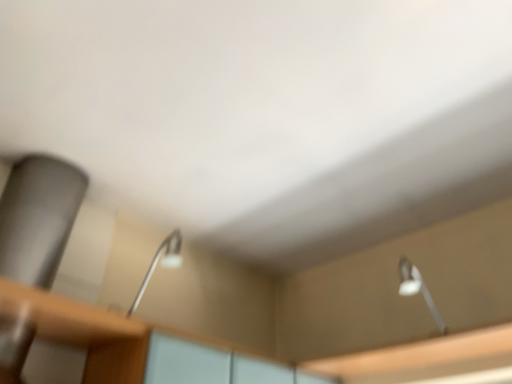
Question: Should I look upward or downward to see metallic silver lamp at center, which is counted as the 1th lamp, starting from the left?

Choices:
 (A) up
 (B) down

Answer: (B)

Question: Is metallic silver lamp at center, positioned as the 2th lamp in right-to-left order, inside white glossy lamp at upper right, arranged as the first lamp when viewed from the right?

Choices:
 (A) yes
 (B) no

Answer: (B)

Question: Is white glossy lamp at upper right, positioned as the second lamp in left-to-right order, to the left of metallic silver lamp at center, which is counted as the 1th lamp, starting from the left, from the viewer's perspective?

Choices:
 (A) yes
 (B) no

Answer: (B)

Question: From the image's perspective, is white glossy lamp at upper right, positioned as the second lamp in left-to-right order, above metallic silver lamp at center, positioned as the 2th lamp in right-to-left order?

Choices:
 (A) no
 (B) yes

Answer: (A)

Question: Is white glossy lamp at upper right, positioned as the second lamp in left-to-right order, at the right side of metallic silver lamp at center, positioned as the 2th lamp in right-to-left order?

Choices:
 (A) yes
 (B) no

Answer: (A)

Question: Is metallic silver lamp at center, which is counted as the 1th lamp, starting from the left, at the back of white glossy lamp at upper right, positioned as the second lamp in left-to-right order?

Choices:
 (A) no
 (B) yes

Answer: (A)

Question: Does white glossy lamp at upper right, arranged as the first lamp when viewed from the right, come in front of metallic silver lamp at center, positioned as the 2th lamp in right-to-left order?

Choices:
 (A) no
 (B) yes

Answer: (A)

Question: Is wooden table at lower left with metallic silver lamp at center, positioned as the 2th lamp in right-to-left order?

Choices:
 (A) no
 (B) yes

Answer: (A)

Question: Can you confirm if wooden table at lower left is smaller than metallic silver lamp at center, positioned as the 2th lamp in right-to-left order?

Choices:
 (A) no
 (B) yes

Answer: (A)

Question: Is wooden table at lower left completely or partially outside of metallic silver lamp at center, positioned as the 2th lamp in right-to-left order?

Choices:
 (A) yes
 (B) no

Answer: (A)

Question: Is wooden table at lower left facing away from metallic silver lamp at center, which is counted as the 1th lamp, starting from the left?

Choices:
 (A) yes
 (B) no

Answer: (B)

Question: Does wooden table at lower left come in front of metallic silver lamp at center, positioned as the 2th lamp in right-to-left order?

Choices:
 (A) no
 (B) yes

Answer: (B)

Question: Is wooden table at lower left positioned behind metallic silver lamp at center, positioned as the 2th lamp in right-to-left order?

Choices:
 (A) yes
 (B) no

Answer: (B)

Question: Is wooden table at lower left a part of white glossy lamp at upper right, positioned as the second lamp in left-to-right order?

Choices:
 (A) no
 (B) yes

Answer: (A)